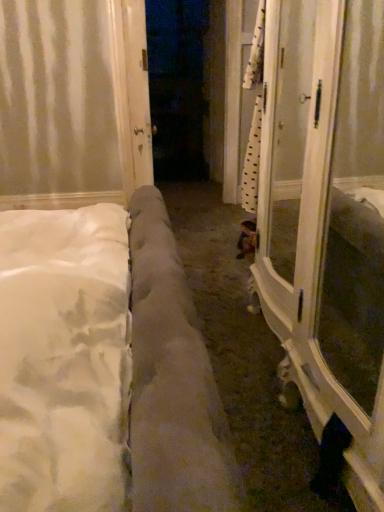
Question: Is white glossy door at center inside the boundaries of white glossy screen door at right, or outside?

Choices:
 (A) outside
 (B) inside

Answer: (A)

Question: Considering the relative positions of white glossy door at center and white glossy screen door at right in the image provided, is white glossy door at center to the left or to the right of white glossy screen door at right?

Choices:
 (A) left
 (B) right

Answer: (A)

Question: Is white glossy door at center wider or thinner than white glossy screen door at right?

Choices:
 (A) wide
 (B) thin

Answer: (B)

Question: Considering the positions of white glossy screen door at right and white glossy door at center in the image, is white glossy screen door at right taller or shorter than white glossy door at center?

Choices:
 (A) tall
 (B) short

Answer: (B)

Question: From the image's perspective, is white glossy screen door at right located above or below white glossy door at center?

Choices:
 (A) above
 (B) below

Answer: (B)

Question: Looking at their shapes, would you say white glossy screen door at right is wider or thinner than white glossy door at center?

Choices:
 (A) wide
 (B) thin

Answer: (A)

Question: Considering the positions of point (312, 303) and point (125, 10), is point (312, 303) closer or farther from the camera than point (125, 10)?

Choices:
 (A) farther
 (B) closer

Answer: (B)